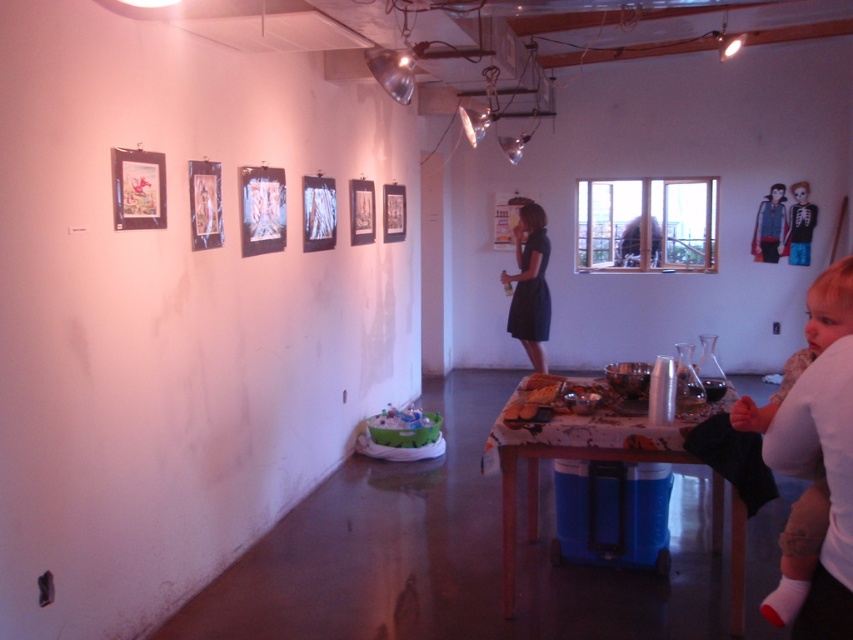
Does wooden table at lower right appear on the left side of white paper doll at upper right?

Indeed, wooden table at lower right is positioned on the left side of white paper doll at upper right.

Does wooden table at lower right appear on the right side of white paper doll at upper right?

No, wooden table at lower right is not to the right of white paper doll at upper right.

Between point (634, 449) and point (798, 196), which one is positioned in front?

Point (634, 449) is more forward.

Locate an element on the screen. wooden table at lower right is located at coordinates (605, 460).

Is point (781, 611) closer to camera compared to point (799, 243)?

Yes.

Can you confirm if light brown fabric baby at lower right is wider than white paper doll at upper right?

Indeed, light brown fabric baby at lower right has a greater width compared to white paper doll at upper right.

What do you see at coordinates (805, 340) in the screenshot?
I see `light brown fabric baby at lower right` at bounding box center [805, 340].

Find the location of a particular element. light brown fabric baby at lower right is located at coordinates (805, 340).

Which is more to the left, blue denim jacket at upper right or white paper doll at upper right?

blue denim jacket at upper right

Between point (767, 198) and point (799, 260), which one is positioned in front?

Positioned in front is point (799, 260).

Which is in front, point (785, 212) or point (792, 193)?

Point (792, 193)

Where is `blue denim jacket at upper right`? blue denim jacket at upper right is located at coordinates (770, 227).